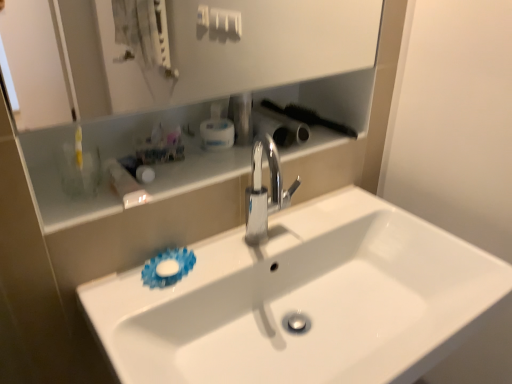
Locate an element on the screen. free space that is to the left of polished chrome faucet at center is located at coordinates (220, 256).